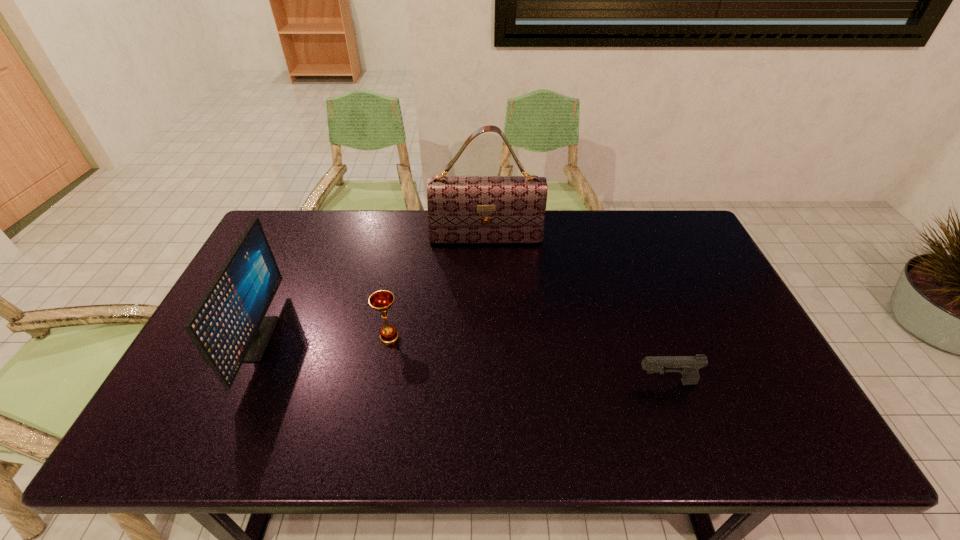
Identify the location of the third object from left to right. The image size is (960, 540). (461, 209).

This screenshot has width=960, height=540. I want to click on the farthest object, so click(461, 209).

The image size is (960, 540). I want to click on the third shortest object, so click(228, 326).

The width and height of the screenshot is (960, 540). Identify the location of computer monitor. [x=228, y=326].

You are a GUI agent. You are given a task and a screenshot of the screen. Output one action in this format:
    pyautogui.click(x=<x>, y=<y>)
    Task: Click on the third tallest object
    Image resolution: width=960 pixels, height=540 pixels.
    Given the screenshot: What is the action you would take?
    pyautogui.click(x=382, y=300)

Image resolution: width=960 pixels, height=540 pixels. In order to click on the third object from right to left in this screenshot , I will do point(382,300).

Find the location of `the shortest object`. the shortest object is located at coordinates (688, 366).

At what (x,y) coordinates should I click in order to perform the action: click on pistol. Please return your answer as a coordinate pair (x, y). Looking at the image, I should click on (688, 366).

The height and width of the screenshot is (540, 960). What are the coordinates of `blank area located 0.340m on the front of the tallest object with the clasp` in the screenshot? It's located at (487, 328).

Where is `vacant space located 0.080m on the screen side of the second tallest object`? The width and height of the screenshot is (960, 540). vacant space located 0.080m on the screen side of the second tallest object is located at coordinates (300, 339).